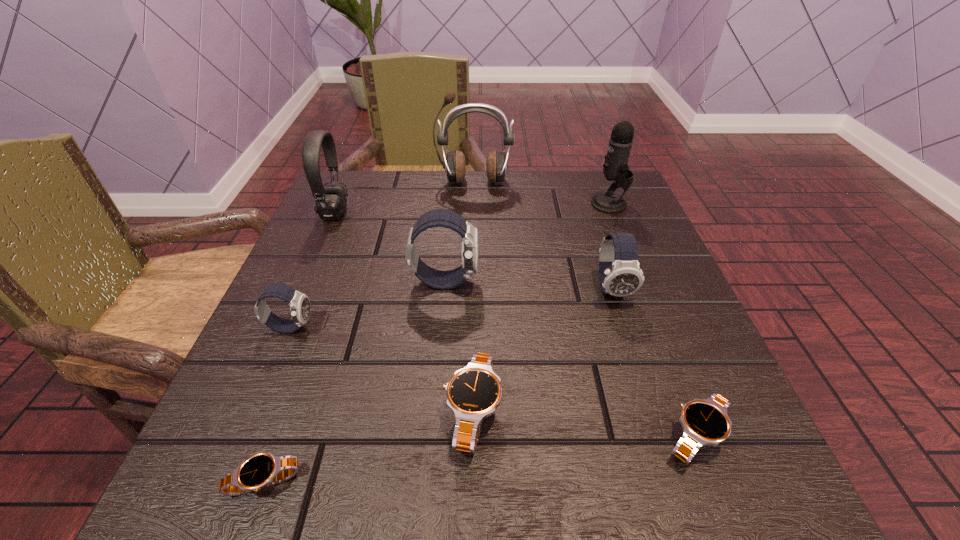
The image size is (960, 540). In order to click on object that is the second nearest to the farthest object in this screenshot , I will do `click(330, 200)`.

Identify which watch is the closest to the fourth tallest object. Please provide its 2D coordinates. Your answer should be formatted as a tuple, i.e. [(x, y)], where the tuple contains the x and y coordinates of a point satisfying the conditions above.

[(473, 393)]

Select which watch is the fifth closest to the brown earphone. Please provide its 2D coordinates. Your answer should be formatted as a tuple, i.e. [(x, y)], where the tuple contains the x and y coordinates of a point satisfying the conditions above.

[(705, 421)]

Identify which dark watch is located as the second nearest to the smallest black watch. Please provide its 2D coordinates. Your answer should be formatted as a tuple, i.e. [(x, y)], where the tuple contains the x and y coordinates of a point satisfying the conditions above.

[(437, 279)]

Identify which dark watch is located as the second nearest to the headset. Please provide its 2D coordinates. Your answer should be formatted as a tuple, i.e. [(x, y)], where the tuple contains the x and y coordinates of a point satisfying the conditions above.

[(299, 303)]

Point out which black watch is positioned as the nearest to the fifth tallest watch. Please provide its 2D coordinates. Your answer should be formatted as a tuple, i.e. [(x, y)], where the tuple contains the x and y coordinates of a point satisfying the conditions above.

[(473, 393)]

Locate an element on the screen. This screenshot has width=960, height=540. black watch that is the closest to the smallest black watch is located at coordinates (473, 393).

Identify the location of free point that satisfies the following two spatial constraints: 1. on the face of the biggest dark watch; 2. on the right side of the biggest black watch. pos(434,411).

Where is `vacant area that satisfies the following two spatial constraints: 1. on the ear pads of the biggest black watch; 2. on the left side of the farthest object`? This screenshot has height=540, width=960. vacant area that satisfies the following two spatial constraints: 1. on the ear pads of the biggest black watch; 2. on the left side of the farthest object is located at coordinates (469, 411).

Image resolution: width=960 pixels, height=540 pixels. I want to click on blank area in the image that satisfies the following two spatial constraints: 1. on the face of the biggest dark watch; 2. on the left side of the biggest black watch, so click(434, 411).